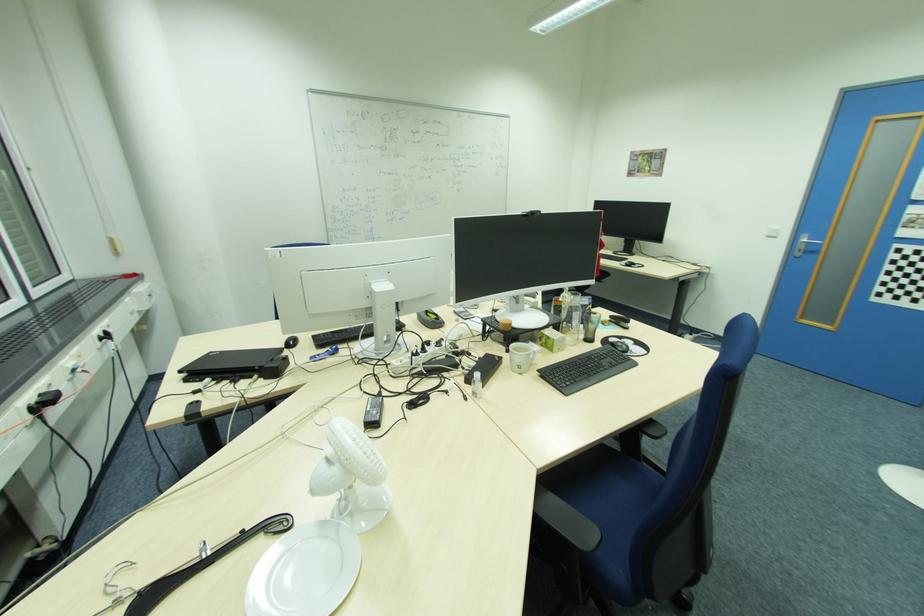
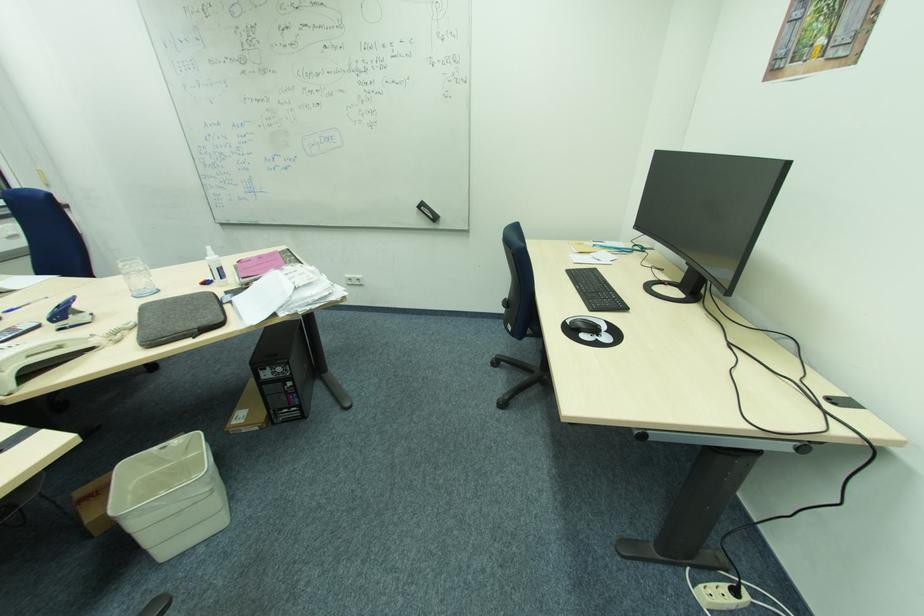
The point at (627, 265) is marked in the first image. Where is the corresponding point in the second image?

(572, 323)